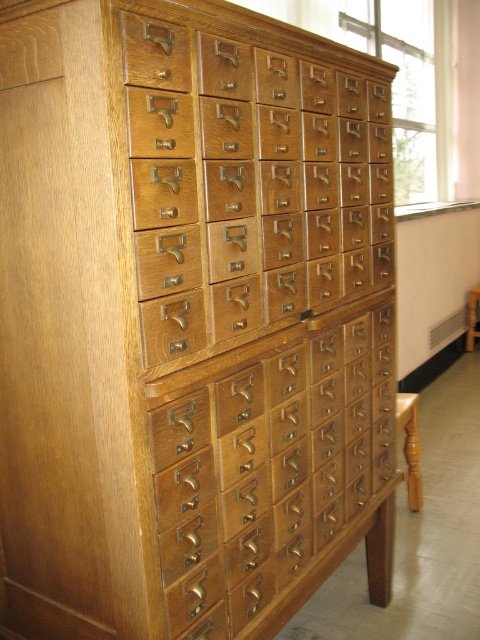
Question: Which object appears closest to the camera in this image?

Choices:
 (A) light brown wood drawer at center
 (B) matte wood drawer at center

Answer: (B)

Question: Is matte wood drawer at center smaller than light brown wood drawer at center?

Choices:
 (A) no
 (B) yes

Answer: (B)

Question: Is matte wood drawer at center thinner than light brown wood drawer at center?

Choices:
 (A) no
 (B) yes

Answer: (B)

Question: Which object appears closest to the camera in this image?

Choices:
 (A) light brown wood drawer at center
 (B) matte wood drawer at center

Answer: (B)

Question: Does matte wood drawer at center have a larger size compared to light brown wood drawer at center?

Choices:
 (A) yes
 (B) no

Answer: (B)

Question: Among these points, which one is farthest from the camera?

Choices:
 (A) (240, 572)
 (B) (190, 125)

Answer: (A)